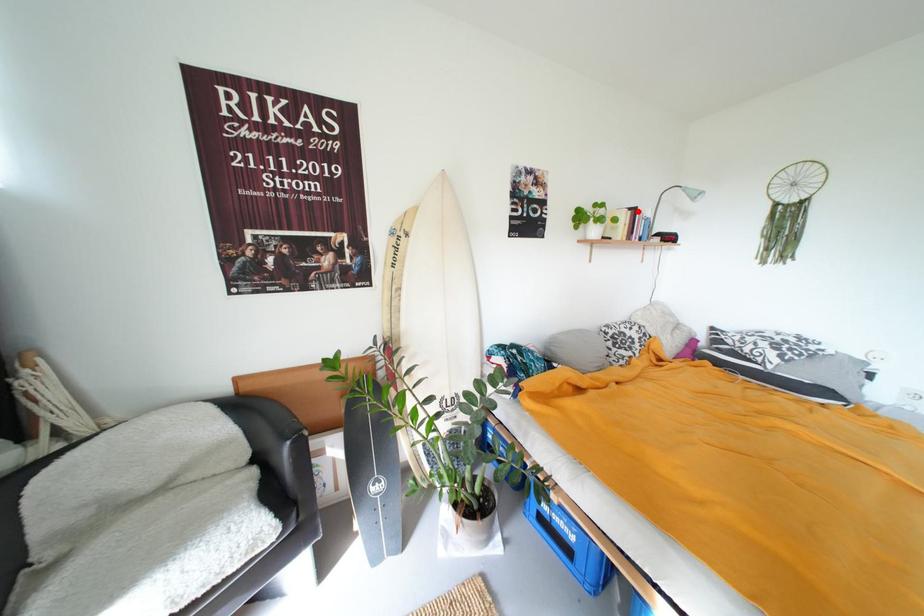
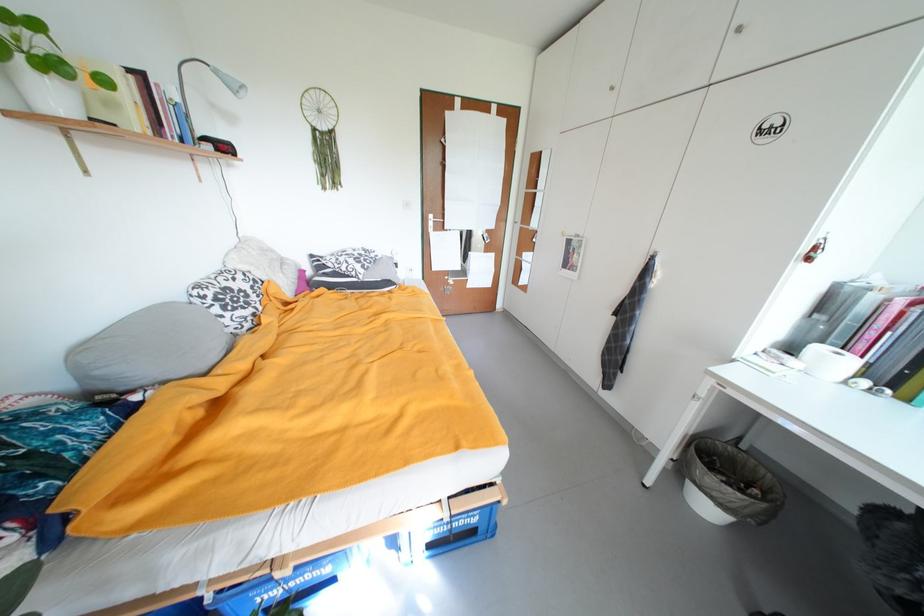
The point at the highlighted location is marked in the first image. Where is the corresponding point in the second image?

(138, 71)